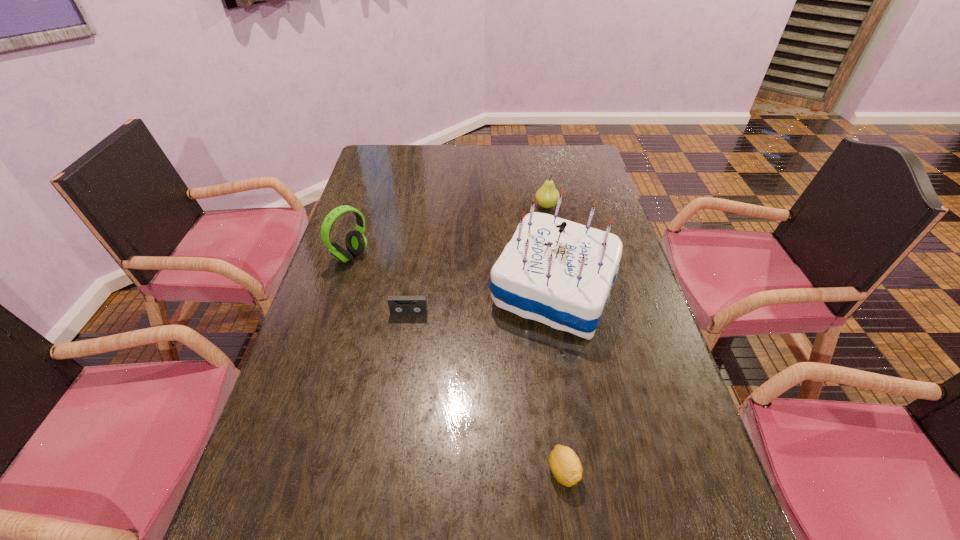
Identify the location of free space between the videotape and the birthday cake. (481, 302).

Where is `vacant space that is in between the birthday cake and the leftmost object`? vacant space that is in between the birthday cake and the leftmost object is located at coordinates (452, 273).

The image size is (960, 540). Identify the location of vacant region between the headset and the second object from left to right. (380, 285).

Locate which object ranks third in proximity to the farthest object. Please provide its 2D coordinates. Your answer should be formatted as a tuple, i.e. [(x, y)], where the tuple contains the x and y coordinates of a point satisfying the conditions above.

[(398, 305)]

Locate an element on the screen. Image resolution: width=960 pixels, height=540 pixels. the fifth closest object to the lemon is located at coordinates (547, 196).